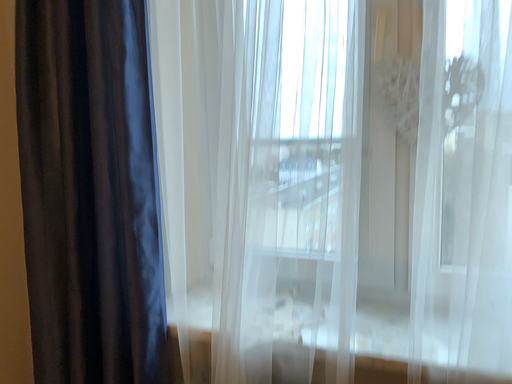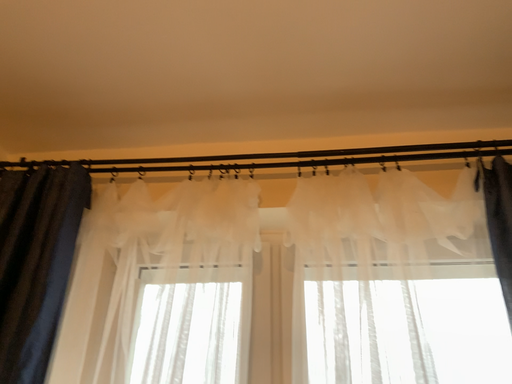
Question: Which way did the camera rotate in the video?

Choices:
 (A) rotated downward
 (B) rotated upward

Answer: (B)